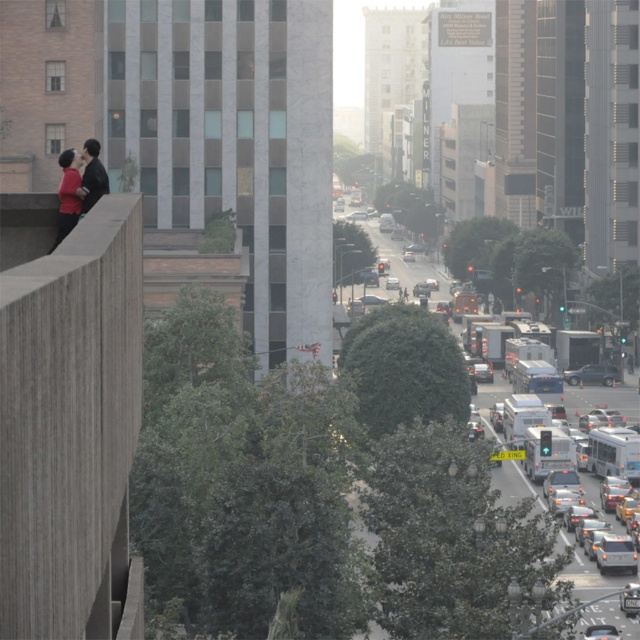
Question: Does metallic silver bus at center lie in front of silver metallic sedan at center-right?

Choices:
 (A) yes
 (B) no

Answer: (A)

Question: Estimate the real-world distances between objects in this image. Which object is farther from the matte black couple at left?

Choices:
 (A) silver metallic sedan at center-right
 (B) metallic silver bus at center

Answer: (A)

Question: Does metallic silver bus at center come in front of silver metallic sedan at center-right?

Choices:
 (A) no
 (B) yes

Answer: (B)

Question: Which point is closer to the camera?

Choices:
 (A) matte black couple at left
 (B) shiny silver sedan at lower right
 (C) metallic silver bus at center
 (D) silver metallic sedan at center-right

Answer: (A)

Question: Which object is farther from the camera taking this photo?

Choices:
 (A) matte black couple at left
 (B) metallic silver bus at center
 (C) shiny silver sedan at lower right

Answer: (C)

Question: Does metallic silver bus at center come in front of silver metallic sedan at center-right?

Choices:
 (A) no
 (B) yes

Answer: (B)